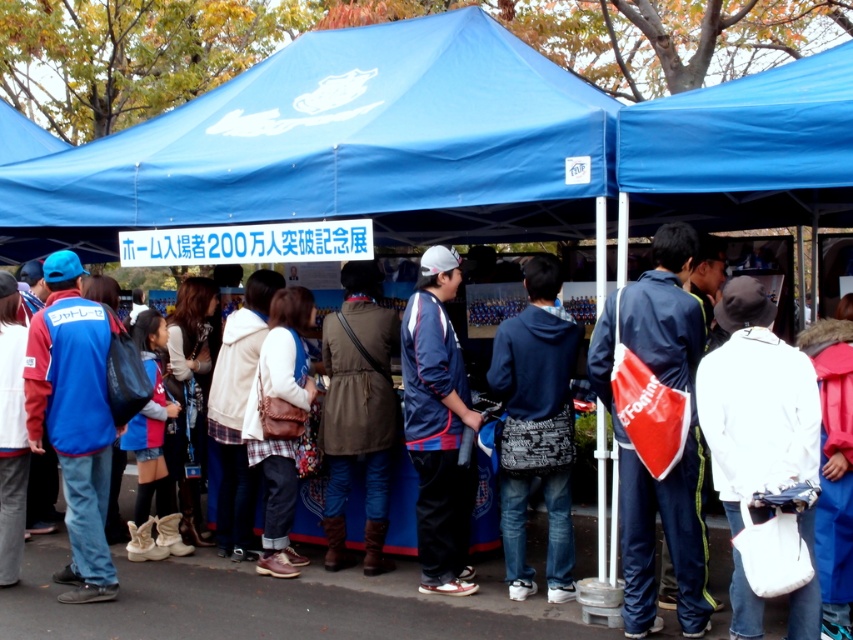
Is blue fabric canopy at center to the right of leather brown bag at center from the viewer's perspective?

Indeed, blue fabric canopy at center is positioned on the right side of leather brown bag at center.

Which is more to the right, blue fabric canopy at center or leather brown bag at center?

blue fabric canopy at center

Locate an element on the screen. blue fabric canopy at center is located at coordinates (350, 145).

Looking at this image, can you confirm if blue fabric canopy at center is bigger than dark blue hoodie at center?

Yes, blue fabric canopy at center is bigger than dark blue hoodie at center.

Between point (1, 172) and point (520, 419), which one is positioned behind?

The point (1, 172) is behind.

Where is `blue fabric canopy at center`? blue fabric canopy at center is located at coordinates (350, 145).

Based on the photo, is blue fabric jacket at center above brown leather jacket at center?

Yes, blue fabric jacket at center is above brown leather jacket at center.

Who is more forward, [434,426] or [358,360]?

Point [434,426] is more forward.

At what (x,y) coordinates should I click in order to perform the action: click on blue fabric jacket at center. Please return your answer as a coordinate pair (x, y). The width and height of the screenshot is (853, 640). Looking at the image, I should click on (438, 426).